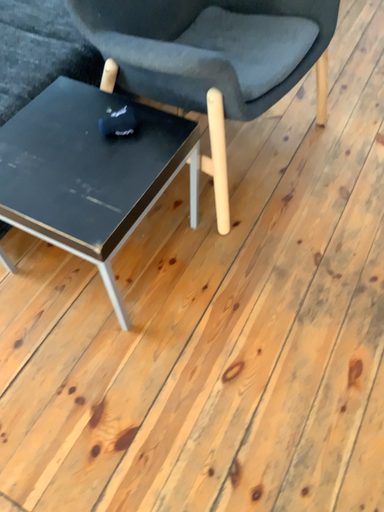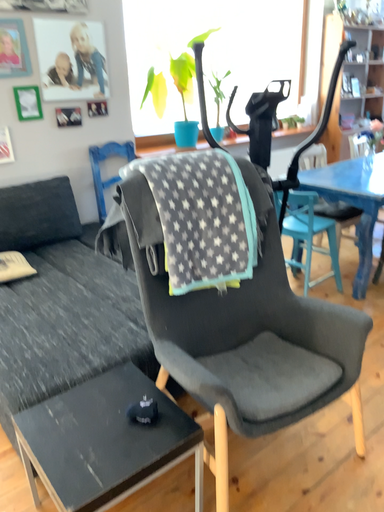
Question: Which way did the camera rotate in the video?

Choices:
 (A) rotated upward
 (B) rotated downward

Answer: (A)